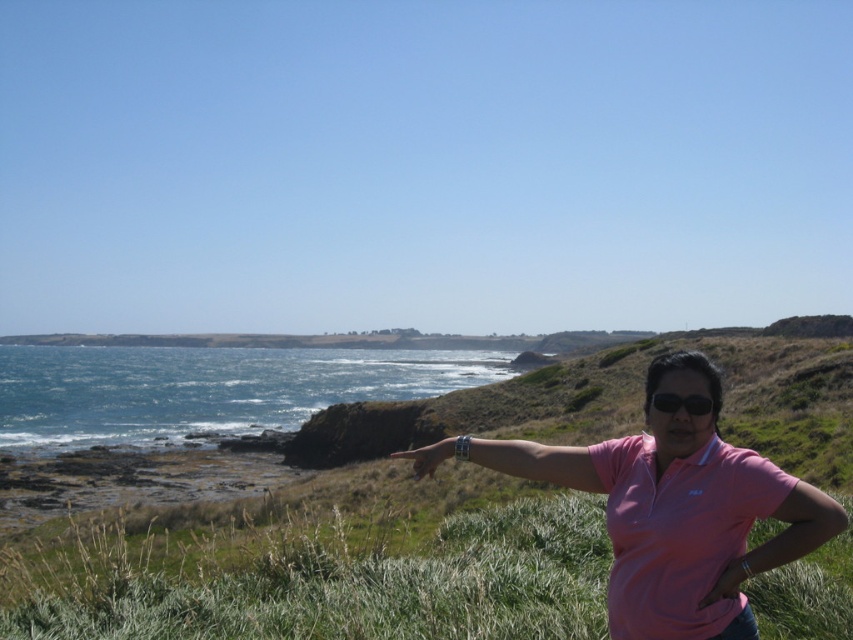
You are a photographer trying to capture the perfect shot of the coastal landscape. You notice the green grassy at lower center and the black matte sunglasses at center in your viewfinder. Based on their positions, which object should you focus on first to ensure both are in frame?

The green grassy at lower center is located below the black matte sunglasses at center, so you should focus on the black matte sunglasses at center first to ensure both are in frame.

You are a drone operator trying to capture a photo of the coastal landscape. The drone is currently hovering at the center of the image. To get the best shot of the green grassy at lower center, in which direction should you move the drone? Specify the direction as a cardinal direction or a combination of cardinal directions.

The green grassy at lower center is located at point (363, 588). Since the drone is at the center of the image, which is point (426, 320), you need to move it southeast to reach the green grassy at lower center.

You are a photographer trying to capture the scene with the green grassy at lower center and the black matte sunglasses at center. To ensure both elements are in the frame, which direction should you position the camera relative to the sunglasses?

The green grassy at lower center is to the left of the black matte sunglasses at center, so you should position the camera to the left side of the sunglasses to include both elements in the frame.